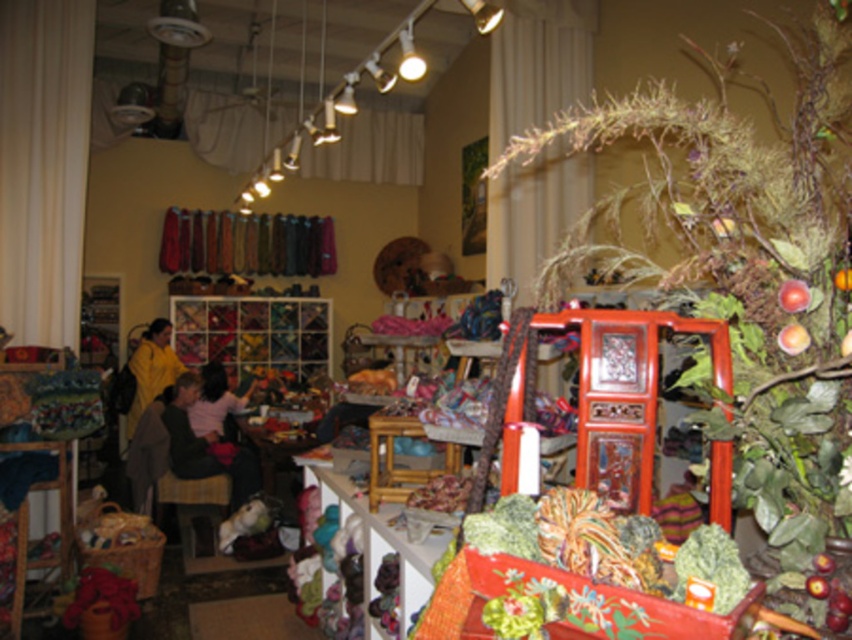
You are a customer in the craft store and want to sit on the bamboo stool at center. However, there is a yellow fabric at left underneath it. Can you sit on the stool without stepping on the fabric?

The bamboo stool at center is positioned over the yellow fabric at left, so sitting on the stool would mean you are also sitting directly on top of the yellow fabric at left. Therefore, you cannot sit on the bamboo stool at center without stepping or sitting on the yellow fabric at left.

You are a customer at the craft store and want to buy a sweater. The store has a dark gray sweater at center and a matte yellow sweater at center. Which sweater is wider?

The dark gray sweater at center is wider than the matte yellow sweater at center.